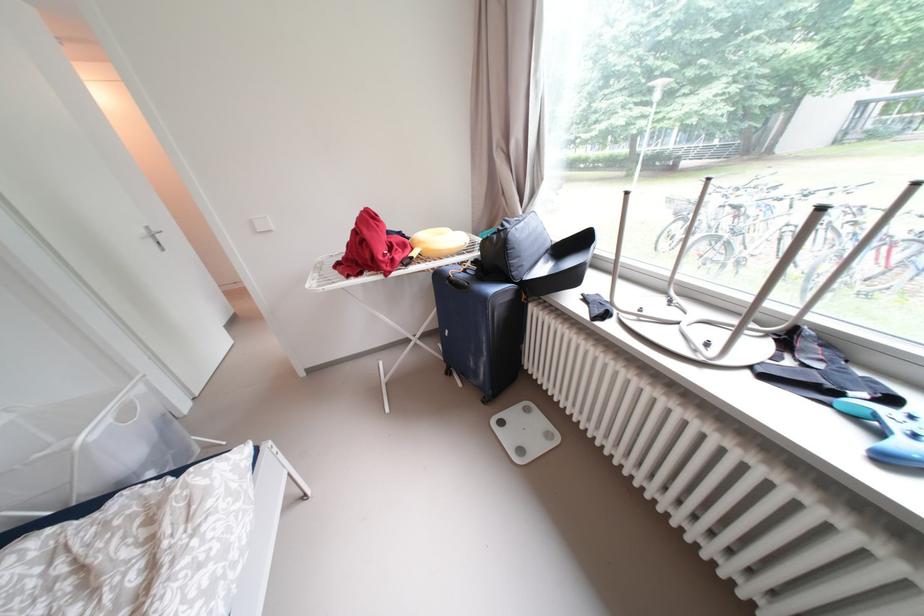
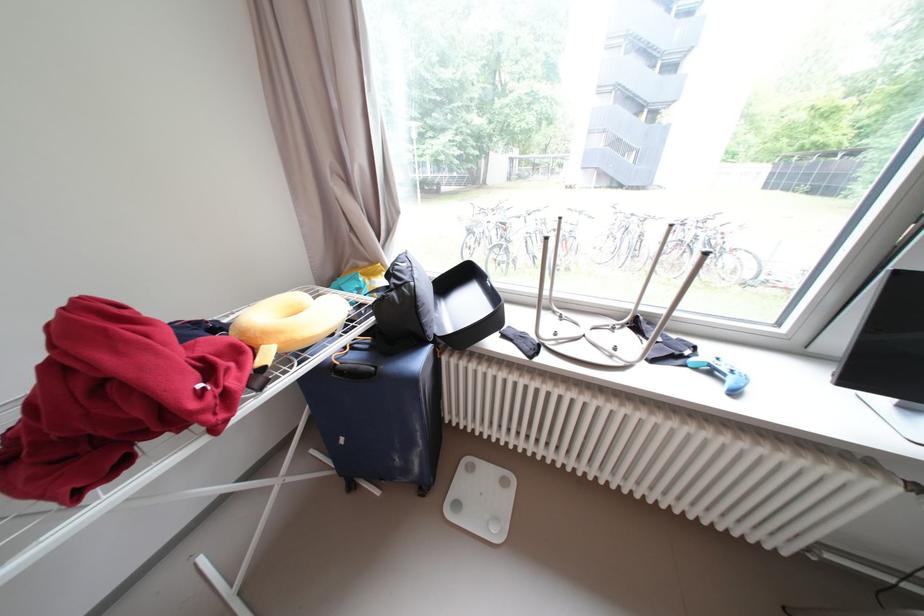
In the second image, find the point that corresponds to point (432, 246) in the first image.

(290, 339)